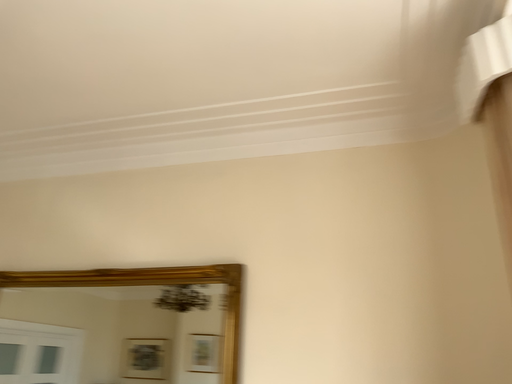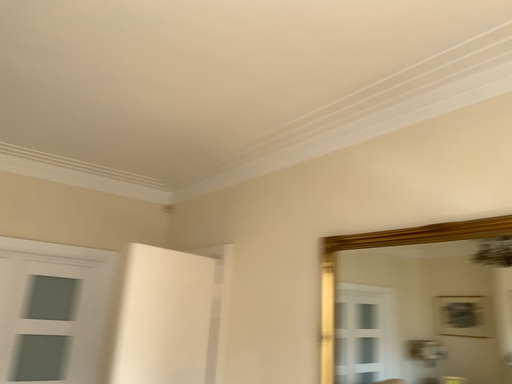
Question: Which way did the camera rotate in the video?

Choices:
 (A) rotated right
 (B) rotated left

Answer: (B)